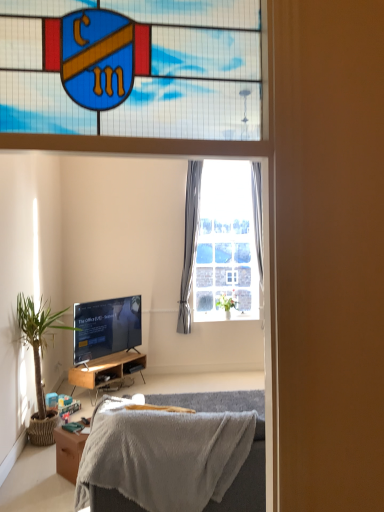
Question: In terms of height, does wooden cabinet at lower left look taller or shorter compared to soft gray blanket at lower center?

Choices:
 (A) short
 (B) tall

Answer: (A)

Question: Do you think wooden cabinet at lower left is within soft gray blanket at lower center, or outside of it?

Choices:
 (A) outside
 (B) inside

Answer: (A)

Question: Which object is the closest to the green leafy plant at left, which appears as the 2th houseplant when viewed from the back?

Choices:
 (A) white sheer curtain at center, which ranks as the 1th curtain in left-to-right order
 (B) stained glass at upper center
 (C) gray fabric curtain at upper center, the 2th curtain viewed from the left
 (D) wooden cabinet at lower left
 (E) matte black tv at lower left

Answer: (E)

Question: Estimate the real-world distances between objects in this image. Which object is closer to the wooden cabinet at lower left?

Choices:
 (A) stained glass at upper center
 (B) green leafy plant at left, marked as the 2th houseplant in a right-to-left arrangement
 (C) matte black tv at lower left
 (D) green leafy plant at upper right, placed as the first houseplant when sorted from back to front
 (E) soft gray blanket at lower center

Answer: (C)